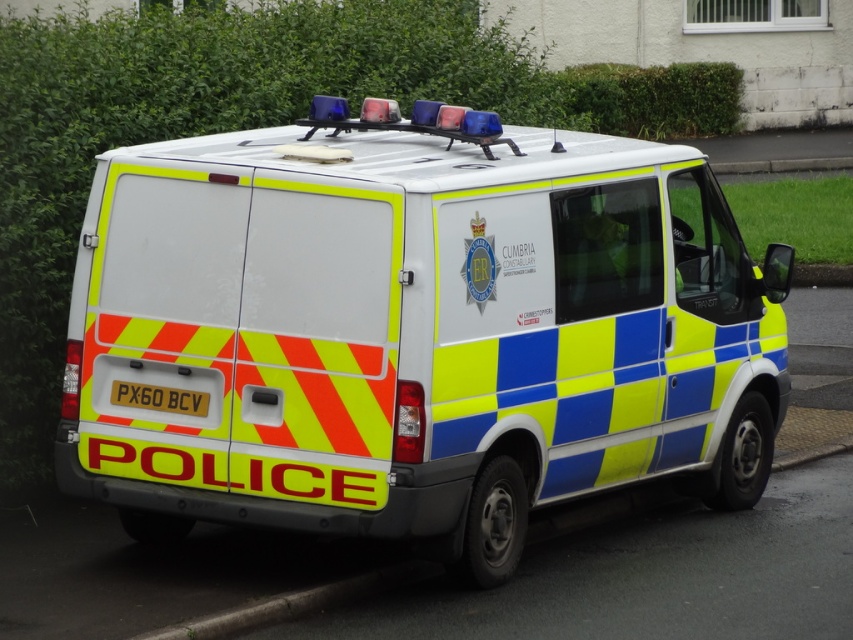
Question: Can you confirm if reflective plastic police van at center is positioned to the right of yellow reflective plastic at rear?

Choices:
 (A) no
 (B) yes

Answer: (B)

Question: Considering the relative positions of reflective plastic police van at center and yellow reflective plastic at rear in the image provided, where is reflective plastic police van at center located with respect to yellow reflective plastic at rear?

Choices:
 (A) left
 (B) right

Answer: (B)

Question: Which point is closer to the camera?

Choices:
 (A) reflective plastic police van at center
 (B) yellow reflective plastic at rear

Answer: (A)

Question: Is reflective plastic police van at center to the left of yellow reflective plastic at rear from the viewer's perspective?

Choices:
 (A) yes
 (B) no

Answer: (B)

Question: Which point appears farthest from the camera in this image?

Choices:
 (A) (142, 396)
 (B) (553, 422)

Answer: (B)